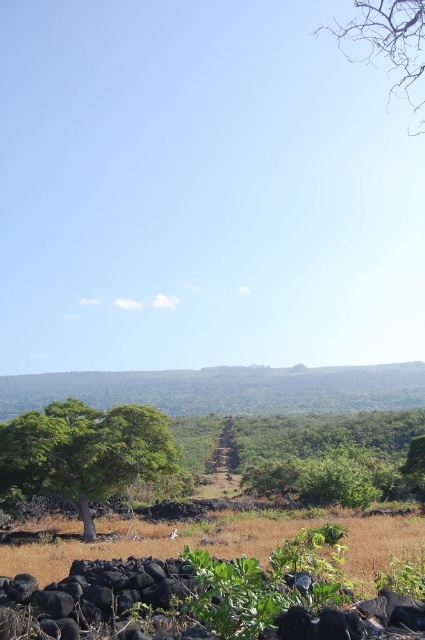
Question: Which point is closer to the camera?

Choices:
 (A) bare branches at upper right
 (B) green leafy tree at left

Answer: (A)

Question: Which point is farther from the camera taking this photo?

Choices:
 (A) (345, 32)
 (B) (96, 433)

Answer: (A)

Question: Which point is closer to the camera?

Choices:
 (A) (399, 33)
 (B) (5, 461)

Answer: (A)

Question: Does green leafy tree at left appear under bare branches at upper right?

Choices:
 (A) yes
 (B) no

Answer: (A)

Question: Can you confirm if green leafy tree at left is thinner than bare branches at upper right?

Choices:
 (A) yes
 (B) no

Answer: (A)

Question: Observing the image, what is the correct spatial positioning of green leafy tree at left in reference to bare branches at upper right?

Choices:
 (A) below
 (B) above

Answer: (A)